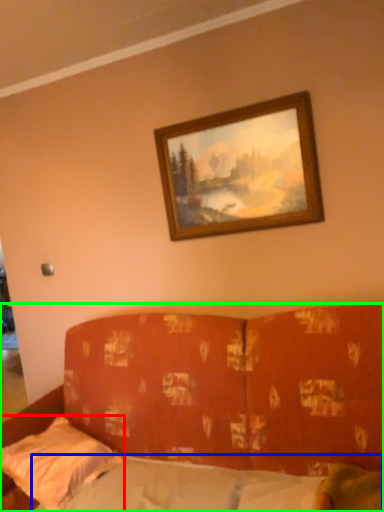
Question: Based on their relative distances, which object is nearer to pillow (highlighted by a red box)? Choose from mattress (highlighted by a blue box) and studio couch (highlighted by a green box).

Choices:
 (A) mattress
 (B) studio couch

Answer: (A)